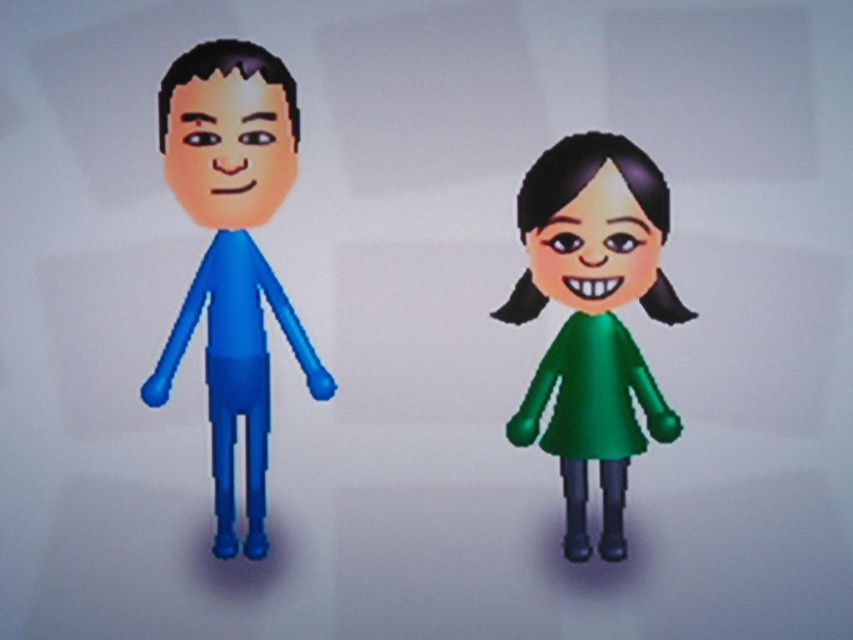
Question: From the image, what is the correct spatial relationship of green matte dress at right in relation to matte orange face at left?

Choices:
 (A) below
 (B) above

Answer: (A)

Question: Is the position of blue rubber doll at left less distant than that of matte orange face at left?

Choices:
 (A) no
 (B) yes

Answer: (B)

Question: Which is nearer to the green matte dress at right?

Choices:
 (A) matte orange face at left
 (B) blue rubber doll at left

Answer: (B)

Question: Considering the real-world distances, which object is closest to the green matte face at right?

Choices:
 (A) matte orange face at left
 (B) blue rubber doll at left

Answer: (B)

Question: Which point appears farthest from the camera in this image?

Choices:
 (A) (641, 276)
 (B) (247, 376)
 (C) (653, 276)
 (D) (231, 198)

Answer: (B)

Question: Can you confirm if green matte dress at right is smaller than green matte face at right?

Choices:
 (A) yes
 (B) no

Answer: (B)